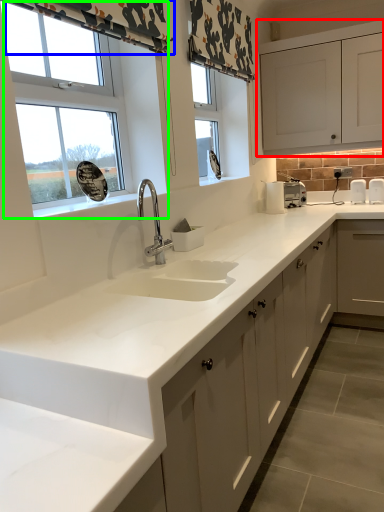
Question: Which is farther away from cabinetry (highlighted by a red box)? curtain (highlighted by a blue box) or window (highlighted by a green box)?

Choices:
 (A) curtain
 (B) window

Answer: (B)